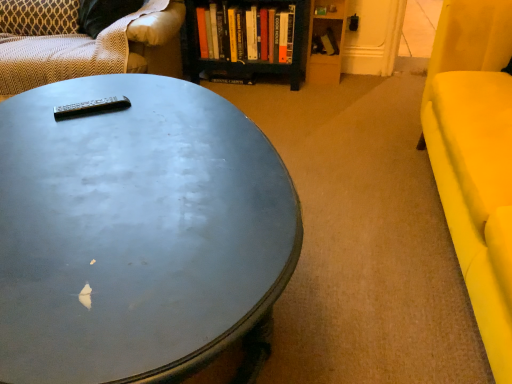
Question: From a real-world perspective, is black plastic remote at center over patterned fabric studio couch at upper left?

Choices:
 (A) no
 (B) yes

Answer: (B)

Question: Does black plastic remote at center contain patterned fabric studio couch at upper left?

Choices:
 (A) no
 (B) yes

Answer: (A)

Question: Does black plastic remote at center have a lesser width compared to patterned fabric studio couch at upper left?

Choices:
 (A) yes
 (B) no

Answer: (A)

Question: Considering the relative sizes of black plastic remote at center and patterned fabric studio couch at upper left in the image provided, is black plastic remote at center shorter than patterned fabric studio couch at upper left?

Choices:
 (A) no
 (B) yes

Answer: (B)

Question: Is black plastic remote at center oriented away from patterned fabric studio couch at upper left?

Choices:
 (A) no
 (B) yes

Answer: (A)

Question: From the image's perspective, is black plastic remote at center on patterned fabric studio couch at upper left?

Choices:
 (A) yes
 (B) no

Answer: (B)

Question: Can you confirm if patterned fabric pillow at upper left is smaller than matte yellow armchair at right?

Choices:
 (A) no
 (B) yes

Answer: (B)

Question: Is matte yellow armchair at right located within patterned fabric pillow at upper left?

Choices:
 (A) no
 (B) yes

Answer: (A)

Question: Is patterned fabric pillow at upper left not within matte yellow armchair at right?

Choices:
 (A) yes
 (B) no

Answer: (A)

Question: From a real-world perspective, is patterned fabric pillow at upper left located higher than matte yellow armchair at right?

Choices:
 (A) yes
 (B) no

Answer: (A)

Question: Is patterned fabric pillow at upper left thinner than matte yellow armchair at right?

Choices:
 (A) no
 (B) yes

Answer: (B)

Question: Would you say patterned fabric pillow at upper left is a long distance from matte yellow armchair at right?

Choices:
 (A) yes
 (B) no

Answer: (A)

Question: Considering the relative positions of patterned fabric studio couch at upper left and black plastic remote at center in the image provided, is patterned fabric studio couch at upper left behind black plastic remote at center?

Choices:
 (A) no
 (B) yes

Answer: (B)